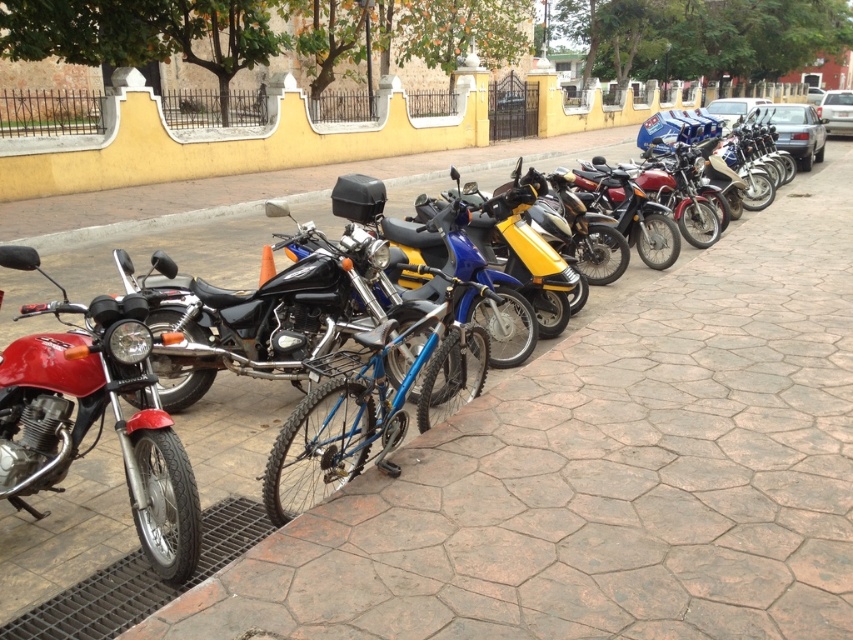
You are standing at the point marked as point [96,419] on the sidewalk. Looking around, you see a shiny red motorcycle at left. Which direction should you face to see the shiny red motorcycle at left?

You should face to the left to see the shiny red motorcycle at left since the point [96,419] is marked at the left side of the image.

You are standing at the center of the sidewalk. Which direction should you walk to reach the shiny red motorcycle at left?

Since the shiny red motorcycle at left is located at point (96,419), you should walk to the left to reach it.

From the picture: You are a delivery person trying to load a package onto the shiny red motorcycle at left and the blue metallic bicycle at center. Which vehicle will require a taller package to be adjusted due to its height?

The shiny red motorcycle at left is taller than the blue metallic bicycle at center, so the package may need to be adjusted for the shiny red motorcycle at left to ensure it doesn not hit the top.